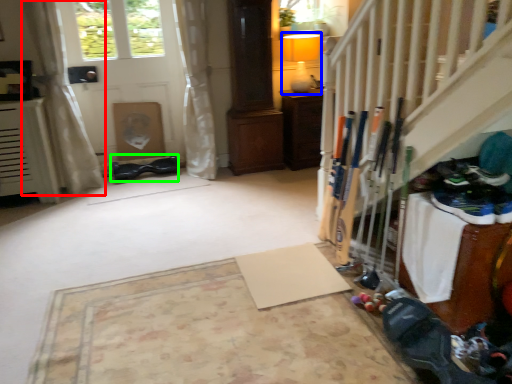
Question: Considering the real-world distances, which object is closest to curtain (highlighted by a red box)? lamp (highlighted by a blue box) or shoe (highlighted by a green box).

Choices:
 (A) lamp
 (B) shoe

Answer: (B)